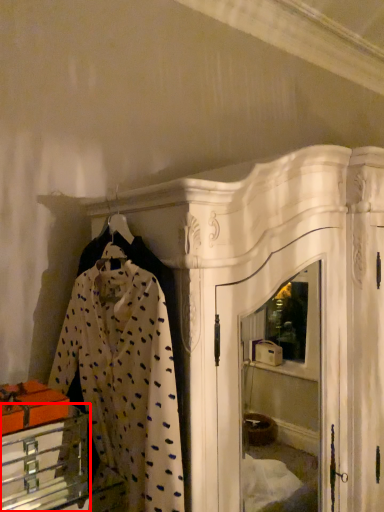
Question: From the image's perspective, considering the relative positions of furniture (annotated by the red box) and clothing in the image provided, where is furniture (annotated by the red box) located with respect to the staircase?

Choices:
 (A) above
 (B) below

Answer: (B)